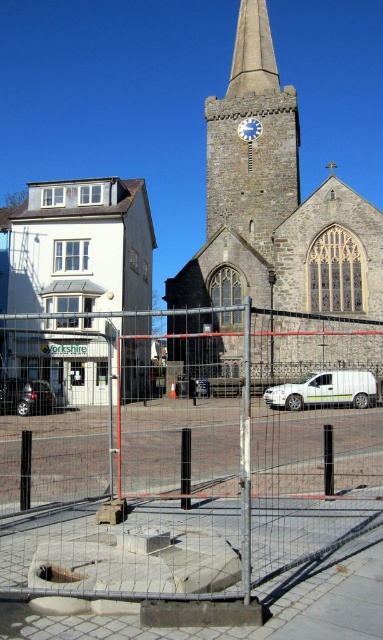
Does stone church at center have a smaller size compared to white matte van at center?

No.

Between point (261, 236) and point (343, 376), which one is positioned behind?

Positioned behind is point (261, 236).

Locate an element on the screen. stone church at center is located at coordinates (276, 204).

Where is `stone church at center`? The height and width of the screenshot is (640, 383). stone church at center is located at coordinates (276, 204).

Which of these two, white matte van at center or blue metallic clock at center, stands taller?

blue metallic clock at center

Between point (356, 396) and point (253, 132), which one is positioned in front?

Positioned in front is point (356, 396).

Identify the location of white matte van at center. Image resolution: width=383 pixels, height=640 pixels. (325, 390).

Is white matte building at left bigger than shiny black car at lower left?

Indeed, white matte building at left has a larger size compared to shiny black car at lower left.

This screenshot has width=383, height=640. Describe the element at coordinates (80, 285) in the screenshot. I see `white matte building at left` at that location.

Is point (83, 285) positioned in front of point (34, 396)?

No.

I want to click on white matte building at left, so click(x=80, y=285).